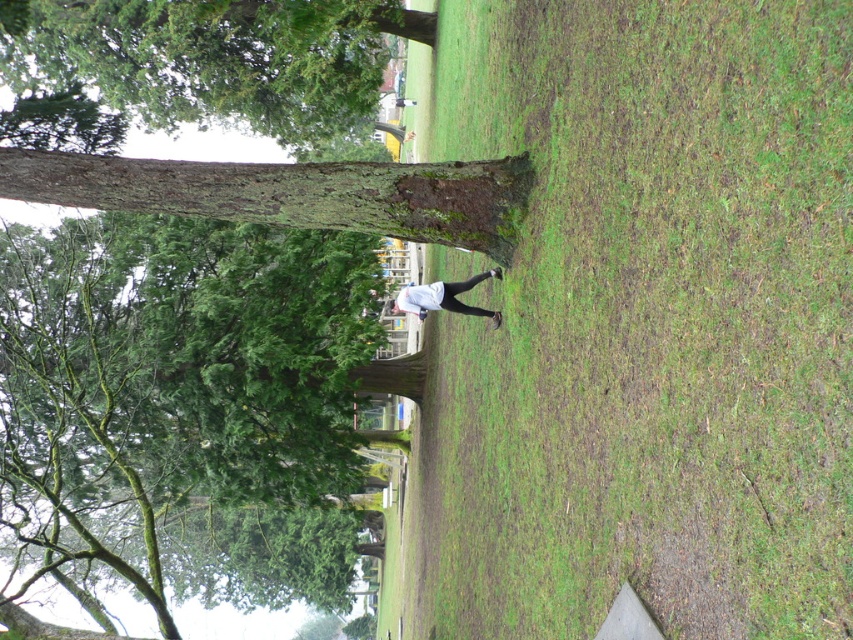
You are a park visitor trying to take a photo of the brown rough tree trunk at center. Since you want the green grass at center to be in the foreground of your photo, should you position yourself closer to or farther from the tree trunk?

To have the green grass at center in the foreground of your photo, you should position yourself closer to the green grass at center and farther from the brown rough tree trunk at center. Since the green grass at center is in front of the brown rough tree trunk at center, moving closer to the grass will ensure it appears prominently at the front of the image while the tree trunk remains slightly behind in the background.